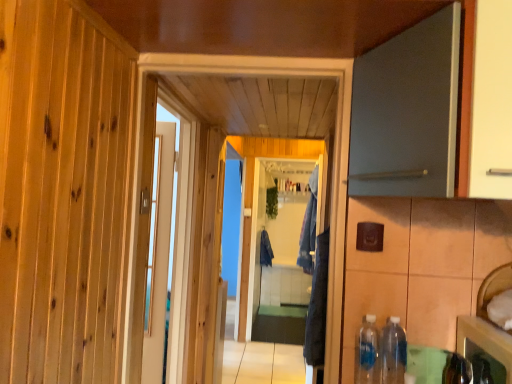
At what (x,y) coordinates should I click in order to perform the action: click on matte gray door at upper right, placed as the 1th door when sorted from front to back. Please return your answer as a coordinate pair (x, y). The image size is (512, 384). Looking at the image, I should click on (407, 112).

Identify the location of shiny metallic cabinet at lower right. (485, 340).

This screenshot has width=512, height=384. I want to click on clear plastic bottle at lower right, which is the 1th bottle from right to left, so click(x=393, y=352).

The image size is (512, 384). Describe the element at coordinates (367, 352) in the screenshot. I see `translucent plastic bottle at lower right, which is counted as the 1th bottle, starting from the left` at that location.

In order to face translucent plastic bottle at lower right, which is counted as the 1th bottle, starting from the left, should I rotate leftwards or rightwards?

Rotate your view right by about 15.282°.

What do you see at coordinates (287, 264) in the screenshot? This screenshot has width=512, height=384. I see `clear glass screen door at center` at bounding box center [287, 264].

The width and height of the screenshot is (512, 384). Identify the location of white glossy door at center, which is counted as the first door, starting from the left. (159, 256).

The width and height of the screenshot is (512, 384). Identify the location of door that is above the white glossy door at center, which is counted as the first door, starting from the left (from the image's perspective). pos(407,112).

Consider the image. From a real-world perspective, between white glossy door at center, which is counted as the first door, starting from the left, and matte gray door at upper right, placed as the first door when sorted from right to left, who is vertically higher?

matte gray door at upper right, placed as the first door when sorted from right to left, from a real-world perspective.

Which object is closer to the camera taking this photo, white glossy door at center, which is counted as the 2th door, starting from the front, or matte gray door at upper right, the second door positioned from the left?

matte gray door at upper right, the second door positioned from the left, is more forward.

Is white glossy door at center, the second door when ordered from right to left, directly adjacent to matte gray door at upper right, the second door positioned from the left?

white glossy door at center, the second door when ordered from right to left, and matte gray door at upper right, the second door positioned from the left, are clearly separated.

Considering the relative positions of white glossy door at center, the second door when ordered from right to left, and clear glass screen door at center in the image provided, is white glossy door at center, the second door when ordered from right to left, to the right of clear glass screen door at center from the viewer's perspective?

Incorrect, white glossy door at center, the second door when ordered from right to left, is not on the right side of clear glass screen door at center.

Between point (165, 218) and point (314, 191), which one is positioned in front?

Positioned in front is point (165, 218).

Consider the image. What's the angular difference between white glossy door at center, the first door viewed from the back, and clear glass screen door at center's facing directions?

The angular difference between white glossy door at center, the first door viewed from the back, and clear glass screen door at center is 7.74 degrees.

Is white glossy door at center, the first door viewed from the back, bigger or smaller than clear glass screen door at center?

white glossy door at center, the first door viewed from the back, is smaller than clear glass screen door at center.

Is clear plastic bottle at lower right, which is the 1th bottle from right to left, inside or outside of dark blue fabric at center, the second laundry viewed from the front?

clear plastic bottle at lower right, which is the 1th bottle from right to left, exists outside the volume of dark blue fabric at center, the second laundry viewed from the front.

In the scene shown: Is clear plastic bottle at lower right, which is the 1th bottle from right to left, facing towards dark blue fabric at center, the second laundry viewed from the front?

No, clear plastic bottle at lower right, which is the 1th bottle from right to left, is not turned towards dark blue fabric at center, the second laundry viewed from the front.

Identify the location of laundry below the clear plastic bottle at lower right, the second bottle positioned from the left (from the image's perspective). The image size is (512, 384). (265, 249).

From the image's perspective, is translucent plastic bottle at lower right, which is counted as the 1th bottle, starting from the left, below clear plastic bottle at lower right, which is the 1th bottle from right to left?

Actually, translucent plastic bottle at lower right, which is counted as the 1th bottle, starting from the left, appears above clear plastic bottle at lower right, which is the 1th bottle from right to left, in the image.

Which is correct: translucent plastic bottle at lower right, which ranks as the 2th bottle in right-to-left order, is inside clear plastic bottle at lower right, which is the 1th bottle from right to left, or outside of it?

translucent plastic bottle at lower right, which ranks as the 2th bottle in right-to-left order, is spatially situated outside clear plastic bottle at lower right, which is the 1th bottle from right to left.

Considering the relative positions of translucent plastic bottle at lower right, which ranks as the 2th bottle in right-to-left order, and clear plastic bottle at lower right, which is the 1th bottle from right to left, in the image provided, is translucent plastic bottle at lower right, which ranks as the 2th bottle in right-to-left order, to the left of clear plastic bottle at lower right, which is the 1th bottle from right to left, from the viewer's perspective?

Correct, you'll find translucent plastic bottle at lower right, which ranks as the 2th bottle in right-to-left order, to the left of clear plastic bottle at lower right, which is the 1th bottle from right to left.

Is point (268, 243) in front of point (307, 227)?

No, (268, 243) is further to viewer.

Does dark blue fabric at center, which ranks as the second laundry in right-to-left order, turn towards clear glass screen door at center?

Yes, dark blue fabric at center, which ranks as the second laundry in right-to-left order, is turned towards clear glass screen door at center.

Is dark blue fabric at center, which is counted as the 1th laundry, starting from the back, beside clear glass screen door at center?

dark blue fabric at center, which is counted as the 1th laundry, starting from the back, is not next to clear glass screen door at center, and they're not touching.

Looking at this image, does dark blue fabric at center, the 1th laundry from the left, have a lesser width compared to clear glass screen door at center?

No, dark blue fabric at center, the 1th laundry from the left, is not thinner than clear glass screen door at center.

Is the depth of clear plastic bottle at lower right, which is the 1th bottle from right to left, less than that of matte gray door at upper right, positioned as the 2th door in back-to-front order?

No, it is behind matte gray door at upper right, positioned as the 2th door in back-to-front order.

Who is bigger, clear plastic bottle at lower right, the second bottle positioned from the left, or matte gray door at upper right, positioned as the 2th door in back-to-front order?

With larger size is matte gray door at upper right, positioned as the 2th door in back-to-front order.

Is there a large distance between clear plastic bottle at lower right, which is the 1th bottle from right to left, and matte gray door at upper right, positioned as the 2th door in back-to-front order?

clear plastic bottle at lower right, which is the 1th bottle from right to left, is actually quite close to matte gray door at upper right, positioned as the 2th door in back-to-front order.

From the matte gray door at upper right, the second door positioned from the left, count 1st bottles backward and point to it. Please provide its 2D coordinates.

[(393, 352)]

From a real-world perspective, is dark blue fabric at center, which ranks as the second laundry in right-to-left order, above or below white glossy door at center, which is counted as the 2th door, starting from the front?

dark blue fabric at center, which ranks as the second laundry in right-to-left order, is situated lower than white glossy door at center, which is counted as the 2th door, starting from the front, in the real world.

Is dark blue fabric at center, which is counted as the 1th laundry, starting from the back, in front of or behind white glossy door at center, which is counted as the first door, starting from the left, in the image?

dark blue fabric at center, which is counted as the 1th laundry, starting from the back, is positioned farther from the viewer than white glossy door at center, which is counted as the first door, starting from the left.

Does dark blue fabric at center, the second laundry viewed from the front, have a larger size compared to white glossy door at center, which is counted as the first door, starting from the left?

Yes.

Is dark blue fabric at center, which is counted as the 1th laundry, starting from the back, outside of white glossy door at center, the first door viewed from the back?

Yes, dark blue fabric at center, which is counted as the 1th laundry, starting from the back, is located beyond the bounds of white glossy door at center, the first door viewed from the back.

This screenshot has width=512, height=384. Find the location of `door located above the white glossy door at center, the first door viewed from the back (from a real-world perspective)`. door located above the white glossy door at center, the first door viewed from the back (from a real-world perspective) is located at coordinates point(407,112).

Find the location of a particular element. This screenshot has height=384, width=512. screen door below the white glossy door at center, the second door when ordered from right to left (from the image's perspective) is located at coordinates (287, 264).

Looking at the image, which one is located further to clear plastic bottle at lower right, which is the 1th bottle from right to left, dark blue fabric at center, the 1th laundry from the left, or matte gray door at upper right, placed as the 1th door when sorted from front to back?

dark blue fabric at center, the 1th laundry from the left, is positioned further to the anchor clear plastic bottle at lower right, which is the 1th bottle from right to left.

Estimate the real-world distances between objects in this image. Which object is closer to translucent plastic bottle at lower right, which is counted as the 1th bottle, starting from the left, blue fabric laundry at center, which is the 1th laundry in right-to-left order, or clear plastic bottle at lower right, which is the 1th bottle from right to left?

clear plastic bottle at lower right, which is the 1th bottle from right to left, is positioned closer to the anchor translucent plastic bottle at lower right, which is counted as the 1th bottle, starting from the left.

When comparing their distances from dark blue fabric at center, the second laundry viewed from the front, does blue fabric laundry at center, the second laundry in the back-to-front sequence, or shiny metallic cabinet at lower right seem closer?

blue fabric laundry at center, the second laundry in the back-to-front sequence, is closer to dark blue fabric at center, the second laundry viewed from the front.

When comparing their distances from white glossy door at center, which is counted as the 2th door, starting from the front, does clear plastic bottle at lower right, which is the 1th bottle from right to left, or matte gray door at upper right, placed as the 1th door when sorted from front to back, seem closer?

clear plastic bottle at lower right, which is the 1th bottle from right to left, is closer to white glossy door at center, which is counted as the 2th door, starting from the front.

Which object lies nearer to the anchor point clear plastic bottle at lower right, the second bottle positioned from the left, clear glass screen door at center or dark blue fabric at center, which is counted as the 1th laundry, starting from the back?

clear glass screen door at center lies closer to clear plastic bottle at lower right, the second bottle positioned from the left, than the other object.

Based on their spatial positions, is clear glass screen door at center or matte gray door at upper right, positioned as the 2th door in back-to-front order, closer to translucent plastic bottle at lower right, which is counted as the 1th bottle, starting from the left?

The object closer to translucent plastic bottle at lower right, which is counted as the 1th bottle, starting from the left, is matte gray door at upper right, positioned as the 2th door in back-to-front order.

Which object lies further to the anchor point dark blue fabric at center, the 1th laundry from the left, translucent plastic bottle at lower right, which is counted as the 1th bottle, starting from the left, or clear plastic bottle at lower right, which is the 1th bottle from right to left?

The object further to dark blue fabric at center, the 1th laundry from the left, is clear plastic bottle at lower right, which is the 1th bottle from right to left.

From the image, which object appears to be farther from translucent plastic bottle at lower right, which is counted as the 1th bottle, starting from the left, matte gray door at upper right, the second door positioned from the left, or white glossy door at center, which is counted as the 2th door, starting from the front?

Based on the image, white glossy door at center, which is counted as the 2th door, starting from the front, appears to be further to translucent plastic bottle at lower right, which is counted as the 1th bottle, starting from the left.

The image size is (512, 384). I want to click on door positioned between matte gray door at upper right, the second door positioned from the left, and blue fabric laundry at center, placed as the 2th laundry when sorted from left to right, from near to far, so click(159, 256).

This screenshot has width=512, height=384. I want to click on screen door between blue fabric laundry at center, which is counted as the first laundry, starting from the front, and dark blue fabric at center, which is counted as the 1th laundry, starting from the back, from front to back, so tap(287, 264).

This screenshot has height=384, width=512. What are the coordinates of `bottle between matte gray door at upper right, positioned as the 2th door in back-to-front order, and clear plastic bottle at lower right, which is the 1th bottle from right to left, in the up-down direction` in the screenshot? It's located at (367, 352).

Where is `door positioned between translucent plastic bottle at lower right, which ranks as the 2th bottle in right-to-left order, and blue fabric laundry at center, which is counted as the first laundry, starting from the front, from near to far`? The image size is (512, 384). door positioned between translucent plastic bottle at lower right, which ranks as the 2th bottle in right-to-left order, and blue fabric laundry at center, which is counted as the first laundry, starting from the front, from near to far is located at coordinates (159, 256).